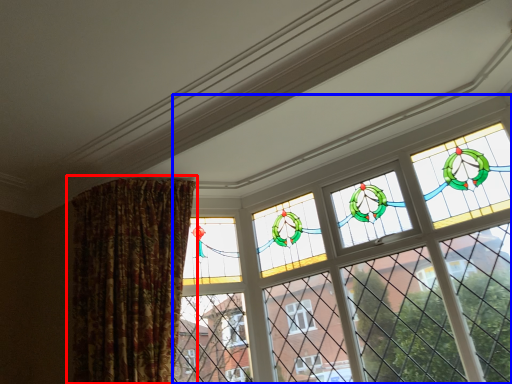
Question: Among these objects, which one is farthest to the camera, curtain (highlighted by a red box) or window (highlighted by a blue box)?

Choices:
 (A) curtain
 (B) window

Answer: (A)